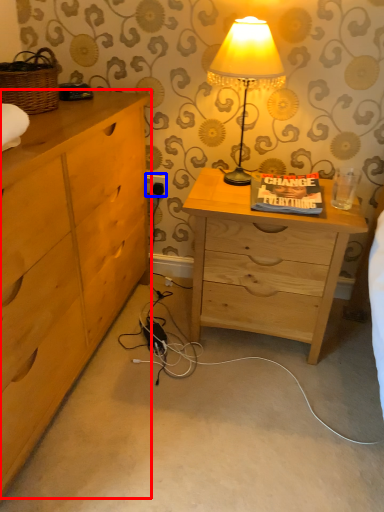
Question: Which object appears closest to the camera in this image, chest of drawers (highlighted by a red box) or electric outlet (highlighted by a blue box)?

Choices:
 (A) chest of drawers
 (B) electric outlet

Answer: (A)